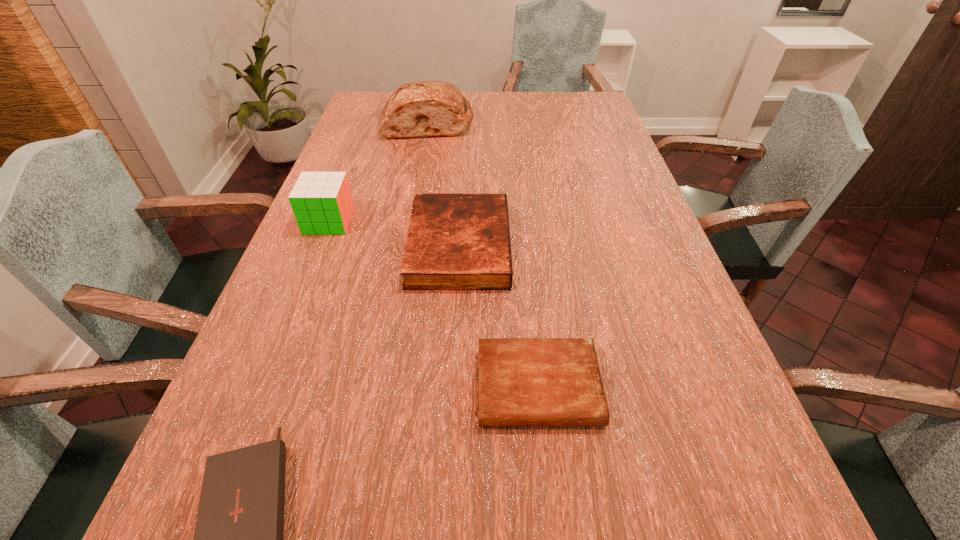
Point out which Bible is positioned as the nearest to the tallest Bible. Please provide its 2D coordinates. Your answer should be formatted as a tuple, i.e. [(x, y)], where the tuple contains the x and y coordinates of a point satisfying the conditions above.

[(522, 381)]

Point out which Bible is positioned as the nearest to the third tallest object. Please provide its 2D coordinates. Your answer should be formatted as a tuple, i.e. [(x, y)], where the tuple contains the x and y coordinates of a point satisfying the conditions above.

[(522, 381)]